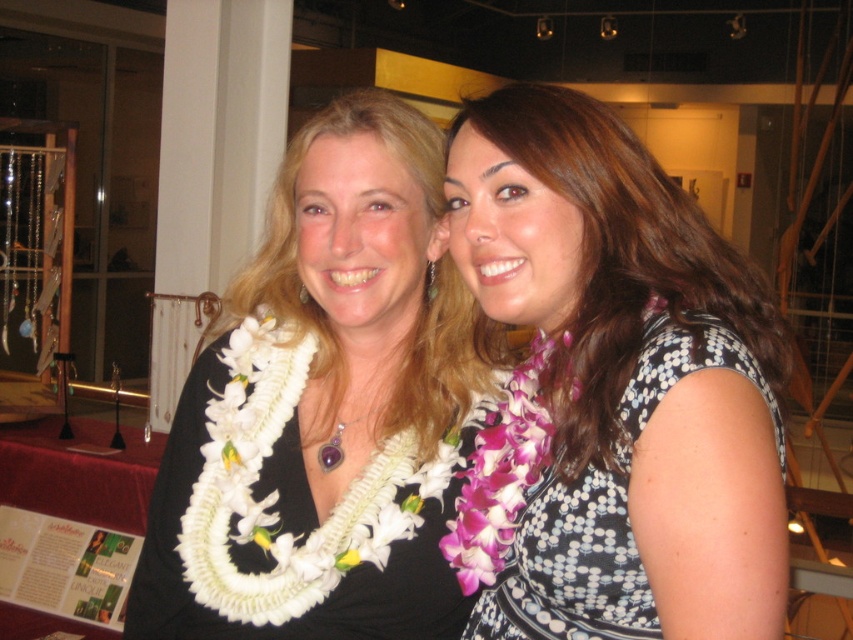
You are a fashion designer who wants to create a matching accessory for the white dotted fabric dress at center. The purple gemstone pendant at center is available in your collection. Based on their positions, can the pendant be worn with the dress without overlapping?

The white dotted fabric dress at center and purple gemstone pendant at center are 34.78 centimeters apart. Since the distance between them is sufficient, the pendant can be worn with the dress without overlapping.

You are a photographer setting up for a group photo. You notice the white fabric lei at center and the purple floral lei at right. Which lei is positioned to the left of the other?

The white fabric lei at center is to the left of the purple floral lei at right.